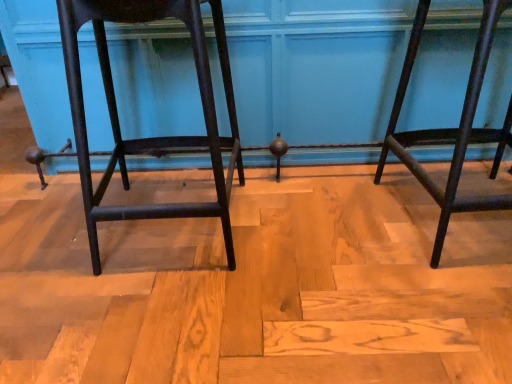
Locate an element on the screen. free space to the left of matte black stool at right, positioned as the second furniture in left-to-right order is located at coordinates (327, 231).